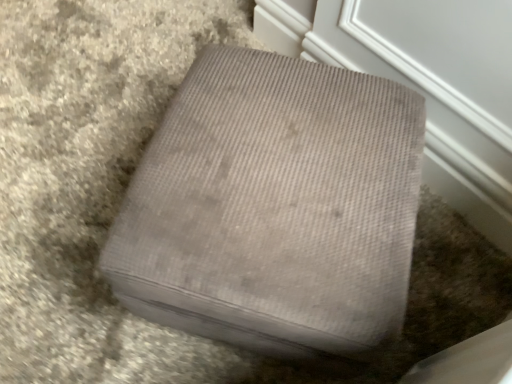
In order to click on vacant space to the left of textured gray ottoman at center in this screenshot , I will do `click(70, 207)`.